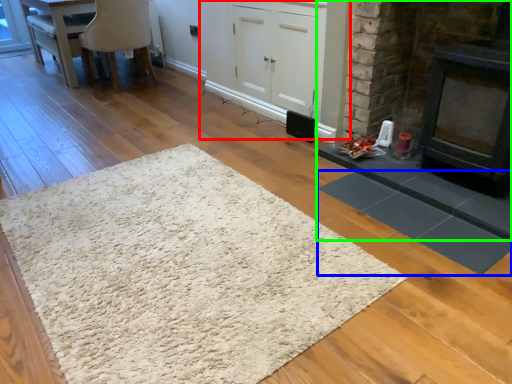
Question: Which object is the farthest from cabinetry (highlighted by a red box)? Choose among these: mat (highlighted by a blue box) or fireplace (highlighted by a green box).

Choices:
 (A) mat
 (B) fireplace

Answer: (A)